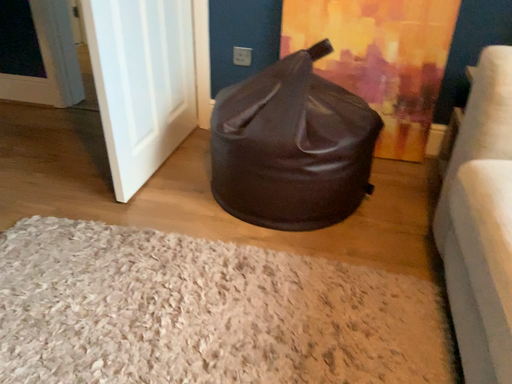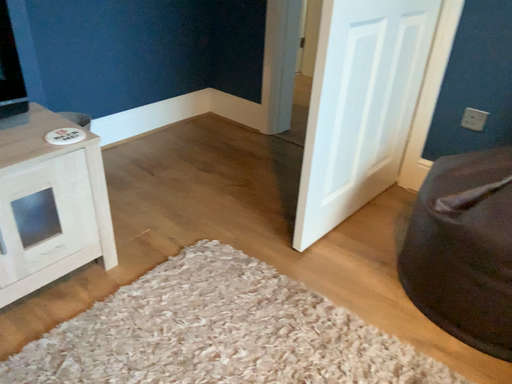
Question: How did the camera likely rotate when shooting the video?

Choices:
 (A) rotated upward
 (B) rotated downward

Answer: (A)